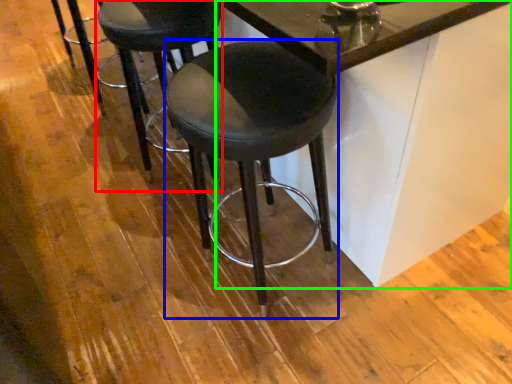
Question: Which object is positioned closest to stool (highlighted by a red box)? Select from stool (highlighted by a blue box) and table (highlighted by a green box).

Choices:
 (A) stool
 (B) table

Answer: (A)